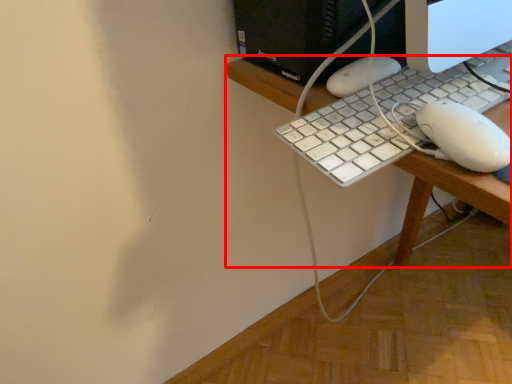
Question: In this image, where is desk (annotated by the red box) located relative to computer keyboard?

Choices:
 (A) right
 (B) left

Answer: (A)